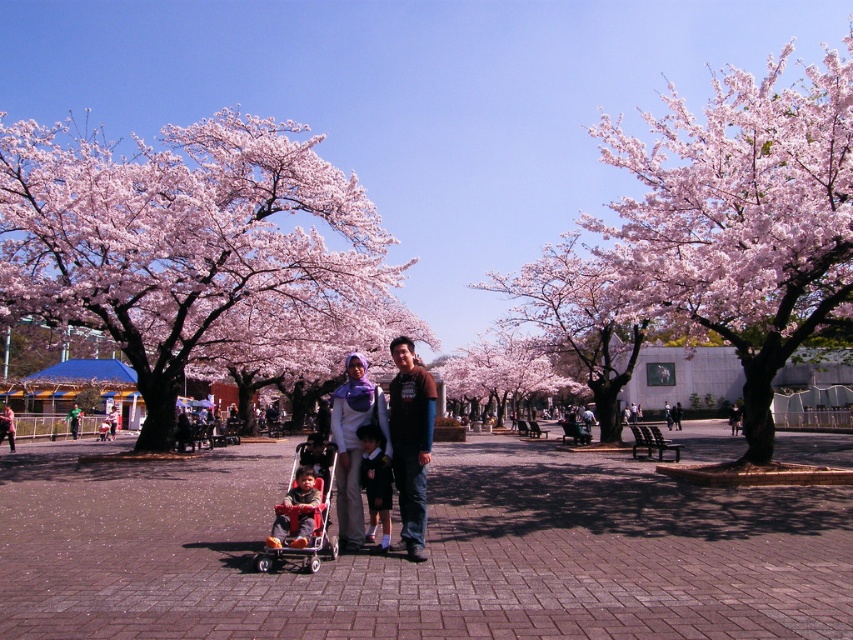
Does brown cotton shirt at center have a larger size compared to red plastic baby carriage at center?

Indeed, brown cotton shirt at center has a larger size compared to red plastic baby carriage at center.

Is point (403, 372) farther from viewer compared to point (270, 550)?

Yes.

What do you see at coordinates (410, 442) in the screenshot? The image size is (853, 640). I see `brown cotton shirt at center` at bounding box center [410, 442].

The width and height of the screenshot is (853, 640). In order to click on brown cotton shirt at center in this screenshot , I will do `click(410, 442)`.

Between point (776, 140) and point (318, 492), which one is positioned in front?

Point (318, 492) is in front.

Can you confirm if pink blossom tree at center is shorter than matte red stroller at lower left?

No.

Is point (724, 323) farther from viewer compared to point (273, 524)?

Yes, point (724, 323) is behind point (273, 524).

This screenshot has width=853, height=640. What are the coordinates of `pink blossom tree at center` in the screenshot? It's located at (740, 218).

Is red plastic baby carriage at center below matte white hijab at center?

Yes, red plastic baby carriage at center is below matte white hijab at center.

The height and width of the screenshot is (640, 853). I want to click on red plastic baby carriage at center, so click(303, 509).